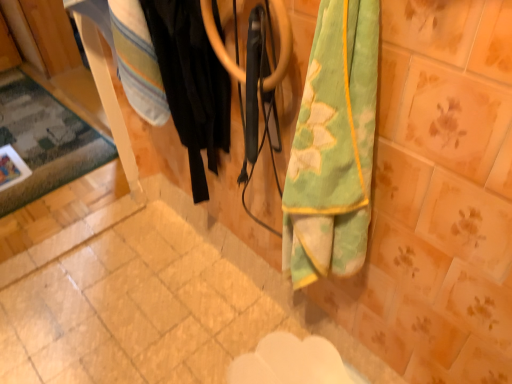
This screenshot has width=512, height=384. What do you see at coordinates (46, 137) in the screenshot?
I see `carpeted rug at left` at bounding box center [46, 137].

I want to click on carpeted rug at left, so click(x=46, y=137).

Based on the photo, measure the distance between black fabric at center and camera.

black fabric at center and camera are 30.58 inches apart.

The image size is (512, 384). Identify the location of black fabric at center. (191, 84).

This screenshot has width=512, height=384. Describe the element at coordinates (191, 84) in the screenshot. I see `black fabric at center` at that location.

Where is `carpeted rug at left`? carpeted rug at left is located at coordinates 46,137.

Can you confirm if black fabric at center is positioned to the right of carpeted rug at left?

Correct, you'll find black fabric at center to the right of carpeted rug at left.

Which is in front, black fabric at center or carpeted rug at left?

black fabric at center is in front.

Is point (198, 77) closer to camera compared to point (100, 153)?

That is True.

From the image's perspective, who appears lower, black fabric at center or carpeted rug at left?

black fabric at center, from the image's perspective.

From a real-world perspective, does black fabric at center sit lower than carpeted rug at left?

No, from a real-world perspective, black fabric at center is not under carpeted rug at left.

Which of these two, black fabric at center or carpeted rug at left, is wider?

carpeted rug at left.

Which of these two, black fabric at center or carpeted rug at left, stands taller?

black fabric at center is taller.

Can you confirm if black fabric at center is smaller than carpeted rug at left?

No, black fabric at center is not smaller than carpeted rug at left.

Choose the correct answer: Is black fabric at center inside carpeted rug at left or outside it?

black fabric at center is spatially situated outside carpeted rug at left.

Based on the photo, is black fabric at center in contact with carpeted rug at left?

black fabric at center and carpeted rug at left are clearly separated.

Is black fabric at center oriented towards carpeted rug at left?

No.

What's the angular difference between black fabric at center and carpeted rug at left's facing directions?

black fabric at center and carpeted rug at left are facing 84.5 degrees away from each other.

This screenshot has width=512, height=384. I want to click on mat below the black fabric at center (from a real-world perspective), so click(x=46, y=137).

Can you confirm if carpeted rug at left is positioned to the right of black fabric at center?

No, carpeted rug at left is not to the right of black fabric at center.

Which object is further away from the camera, carpeted rug at left or black fabric at center?

Positioned behind is carpeted rug at left.

Which point is more forward, (34, 81) or (190, 124)?

The point (190, 124) is closer to the camera.

From the image's perspective, would you say carpeted rug at left is positioned over black fabric at center?

Yes, from the image's perspective, carpeted rug at left is above black fabric at center.

From a real-world perspective, is carpeted rug at left beneath black fabric at center?

Indeed, from a real-world perspective, carpeted rug at left is positioned beneath black fabric at center.

Between carpeted rug at left and black fabric at center, which one has smaller width?

black fabric at center.

Considering the sizes of objects carpeted rug at left and black fabric at center in the image provided, who is taller, carpeted rug at left or black fabric at center?

black fabric at center is taller.

Is carpeted rug at left smaller than black fabric at center?

Yes, carpeted rug at left is smaller than black fabric at center.

Is black fabric at center completely or partially inside carpeted rug at left?

That's incorrect, black fabric at center is not inside carpeted rug at left.

Are carpeted rug at left and black fabric at center located far from each other?

Yes, carpeted rug at left and black fabric at center are quite far apart.

Could you tell me if carpeted rug at left is facing black fabric at center?

No, carpeted rug at left is not turned towards black fabric at center.

The width and height of the screenshot is (512, 384). I want to click on clothing positioned vertically above the carpeted rug at left (from a real-world perspective), so click(191, 84).

The width and height of the screenshot is (512, 384). I want to click on clothing below the carpeted rug at left (from the image's perspective), so click(x=191, y=84).

You are a GUI agent. You are given a task and a screenshot of the screen. Output one action in this format:
    pyautogui.click(x=<x>, y=<y>)
    Task: Click on the clothing on the right of carpeted rug at left
    
    Given the screenshot: What is the action you would take?
    pyautogui.click(x=191, y=84)